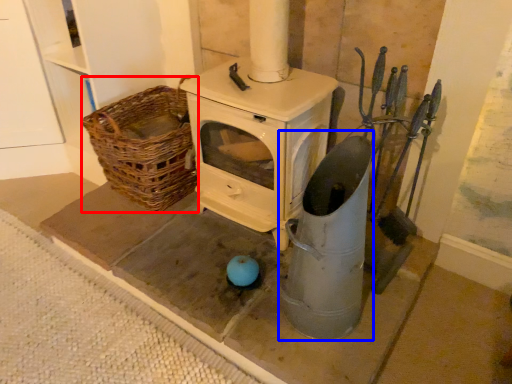
Question: Which point is further to the camera, basket (highlighted by a red box) or appliance (highlighted by a blue box)?

Choices:
 (A) basket
 (B) appliance

Answer: (A)